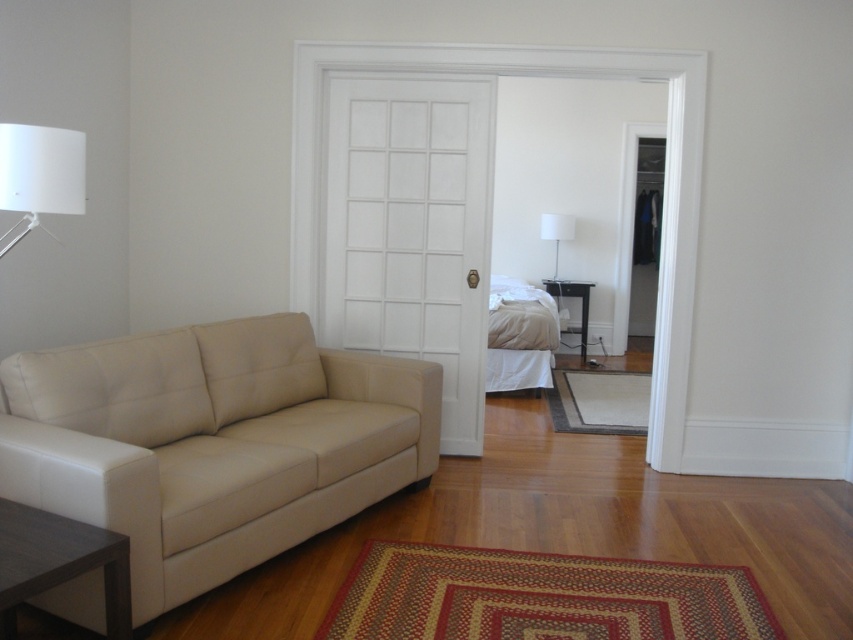
Question: Among these objects, which one is nearest to the camera?

Choices:
 (A) white fabric lampshade at center
 (B) brown wood table at lower left

Answer: (B)

Question: Does white matte lampshade at upper left appear on the left side of white fabric lampshade at center?

Choices:
 (A) no
 (B) yes

Answer: (B)

Question: Can you confirm if brown wood table at lower left is smaller than white matte lampshade at upper left?

Choices:
 (A) no
 (B) yes

Answer: (A)

Question: Is beige leather couch at left smaller than white matte lampshade at upper left?

Choices:
 (A) no
 (B) yes

Answer: (A)

Question: Which object appears closest to the camera in this image?

Choices:
 (A) beige leather couch at left
 (B) brown wood table at lower left
 (C) white matte lampshade at upper left

Answer: (B)

Question: Among these points, which one is farthest from the camera?

Choices:
 (A) (560, 216)
 (B) (215, 492)

Answer: (A)